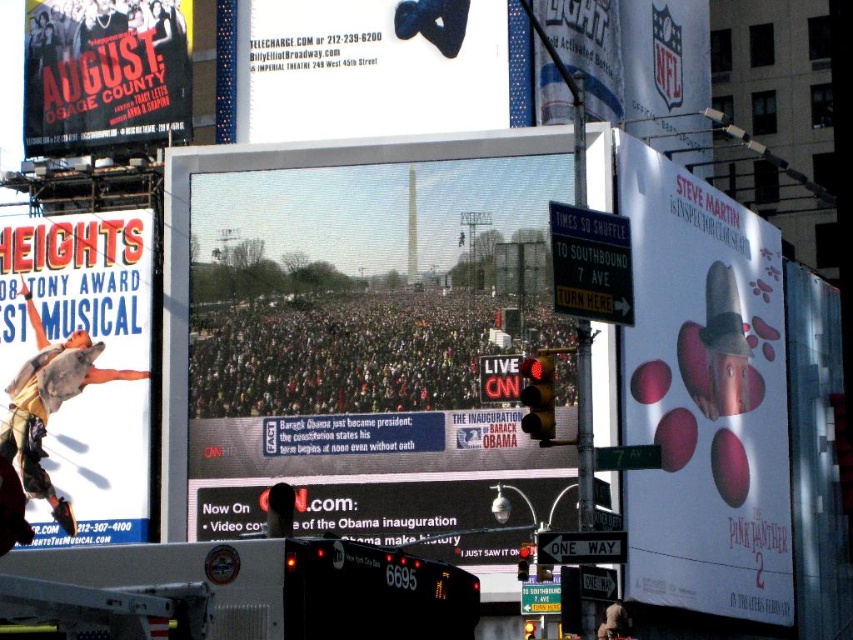
Question: Can you confirm if dark gray crowd at center is smaller than blue fabric sign at upper center?

Choices:
 (A) no
 (B) yes

Answer: (B)

Question: Which point is closer to the camera?

Choices:
 (A) (103, 320)
 (B) (289, 324)
 (C) (601, 548)

Answer: (C)

Question: Which point appears farthest from the camera in this image?

Choices:
 (A) (561, 502)
 (B) (567, 387)
 (C) (541, 550)
 (D) (723, 273)

Answer: (D)

Question: Does matte black poster at upper left have a greater width compared to white plastic sign at center?

Choices:
 (A) no
 (B) yes

Answer: (B)

Question: Is white glossy poster at right below shiny metallic hat at upper right?

Choices:
 (A) no
 (B) yes

Answer: (B)

Question: Which point is farther to the camera?

Choices:
 (A) (218, 348)
 (B) (450, 38)
 (C) (708, 417)

Answer: (C)